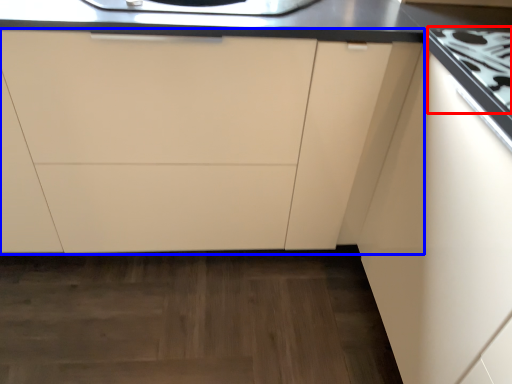
Question: Which object appears closest to the camera in this image, gas stove (highlighted by a red box) or cabinetry (highlighted by a blue box)?

Choices:
 (A) gas stove
 (B) cabinetry

Answer: (A)